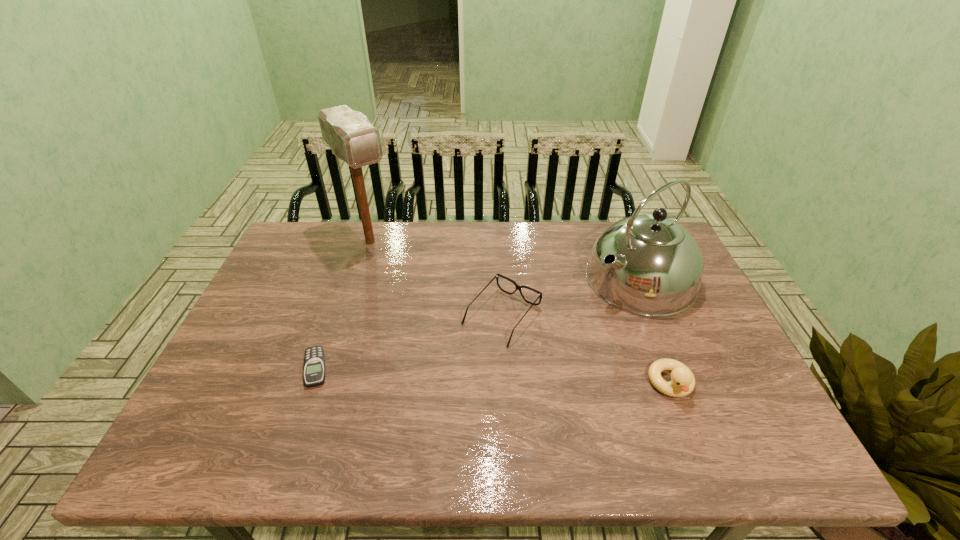
The height and width of the screenshot is (540, 960). Identify the location of beeper. (314, 363).

The image size is (960, 540). In order to click on duckling in this screenshot , I will do `click(682, 383)`.

What are the coordinates of `the tallest object` in the screenshot? It's located at (351, 137).

This screenshot has width=960, height=540. What are the coordinates of `kettle` in the screenshot? It's located at (658, 270).

Locate an element on the screen. spectacles is located at coordinates (497, 276).

At what (x,y) coordinates should I click in order to perform the action: click on the third object from right to left. Please return your answer as a coordinate pair (x, y). This screenshot has width=960, height=540. Looking at the image, I should click on (497, 276).

Identify the location of vacant area situated on the right of the shortest object. (367, 368).

In order to click on vacant area situated 0.390m on the striking face of the tallest object in this screenshot , I will do `click(445, 334)`.

This screenshot has width=960, height=540. I want to click on vacant space located 0.110m on the striking face of the tallest object, so click(398, 277).

This screenshot has height=540, width=960. Find the location of `vacant space situated 0.320m on the striking face of the tallest object`. vacant space situated 0.320m on the striking face of the tallest object is located at coordinates (433, 319).